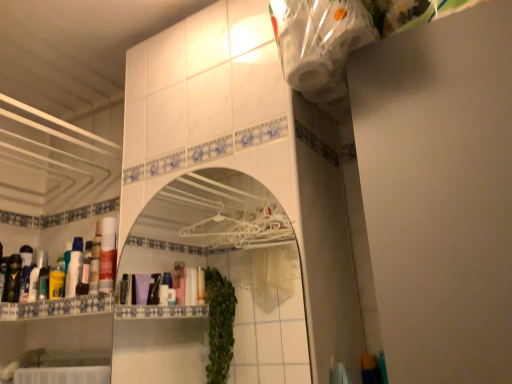
Question: From a real-world perspective, is translucent plastic mouthwash at left, which is counted as the first mouthwash, starting from the right, below white plastic mirror at center?

Choices:
 (A) no
 (B) yes

Answer: (A)

Question: From the image's perspective, would you say translucent plastic mouthwash at left, the third mouthwash viewed from the left, is shown under white plastic mirror at center?

Choices:
 (A) no
 (B) yes

Answer: (B)

Question: Is translucent plastic mouthwash at left, the third mouthwash viewed from the left, behind white plastic mirror at center?

Choices:
 (A) yes
 (B) no

Answer: (A)

Question: Would you say translucent plastic mouthwash at left, the third mouthwash viewed from the left, is outside white plastic mirror at center?

Choices:
 (A) no
 (B) yes

Answer: (B)

Question: Does translucent plastic mouthwash at left, which is counted as the first mouthwash, starting from the right, appear on the left side of white plastic mirror at center?

Choices:
 (A) no
 (B) yes

Answer: (B)

Question: Is translucent plastic mouthwash at left, which is counted as the first mouthwash, starting from the right, positioned in front of white plastic mirror at center?

Choices:
 (A) no
 (B) yes

Answer: (A)

Question: Does matte black lotion at left, which is the 2th toiletry from left to right, touch translucent plastic mouthwash at left, the third mouthwash viewed from the left?

Choices:
 (A) yes
 (B) no

Answer: (B)

Question: Could you tell me if matte black lotion at left, which is the 2th toiletry from left to right, is facing translucent plastic mouthwash at left, which is counted as the first mouthwash, starting from the right?

Choices:
 (A) no
 (B) yes

Answer: (B)

Question: From the image's perspective, is matte black lotion at left, marked as the 2th toiletry in a right-to-left arrangement, above translucent plastic mouthwash at left, which is counted as the first mouthwash, starting from the right?

Choices:
 (A) yes
 (B) no

Answer: (B)

Question: Can you confirm if matte black lotion at left, marked as the 2th toiletry in a right-to-left arrangement, is bigger than translucent plastic mouthwash at left, the third mouthwash viewed from the left?

Choices:
 (A) yes
 (B) no

Answer: (A)

Question: Is matte black lotion at left, marked as the 2th toiletry in a right-to-left arrangement, smaller than translucent plastic mouthwash at left, which is counted as the first mouthwash, starting from the right?

Choices:
 (A) no
 (B) yes

Answer: (A)

Question: Can you confirm if matte black lotion at left, which is the 2th toiletry from left to right, is shorter than translucent plastic mouthwash at left, the third mouthwash viewed from the left?

Choices:
 (A) yes
 (B) no

Answer: (A)

Question: From the image's perspective, is white glossy bottle at left, arranged as the third toiletry when viewed from the left, over matte black lotion at left, marked as the 2th toiletry in a right-to-left arrangement?

Choices:
 (A) yes
 (B) no

Answer: (B)